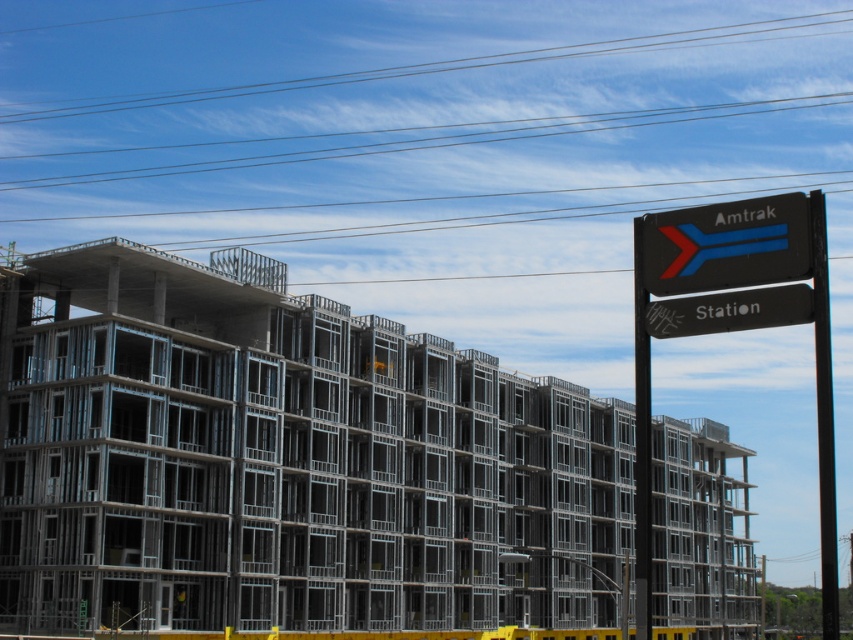
Question: Which object is the closest to the blue glossy arrow at upper right?

Choices:
 (A) gray concrete building at right
 (B) black metal pole at right

Answer: (B)

Question: Which object is farther from the camera taking this photo?

Choices:
 (A) black metal pole at right
 (B) black metal sign at upper right

Answer: (A)

Question: Is black plastic sign at upper right to the left of blue glossy arrow at upper right from the viewer's perspective?

Choices:
 (A) no
 (B) yes

Answer: (A)

Question: Considering the real-world distances, which object is farthest from the blue glossy arrow at upper right?

Choices:
 (A) black plastic sign at upper right
 (B) black metal sign at upper right

Answer: (B)

Question: Is black metal sign at upper right above blue glossy arrow at upper right?

Choices:
 (A) no
 (B) yes

Answer: (A)

Question: In this image, where is black metal sign at upper right located relative to black plastic sign at upper right?

Choices:
 (A) below
 (B) above

Answer: (A)